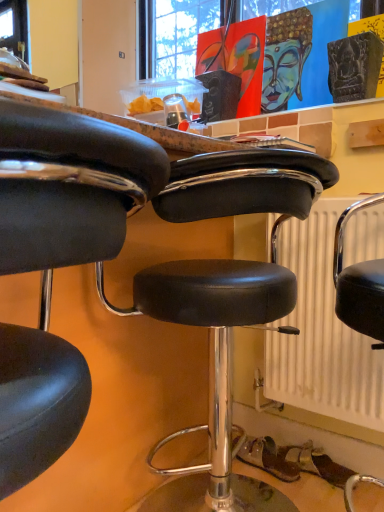
Question: Is the position of white textured radiator at center less distant than that of black leather stool at center, arranged as the second chair when viewed from the front?

Choices:
 (A) yes
 (B) no

Answer: (A)

Question: Is white textured radiator at center next to black leather stool at center, arranged as the second chair when viewed from the front?

Choices:
 (A) no
 (B) yes

Answer: (A)

Question: Considering the relative sizes of white textured radiator at center and black leather stool at center, arranged as the second chair when viewed from the front, in the image provided, is white textured radiator at center wider than black leather stool at center, arranged as the second chair when viewed from the front,?

Choices:
 (A) no
 (B) yes

Answer: (A)

Question: Does white textured radiator at center have a larger size compared to black leather stool at center, arranged as the second chair when viewed from the front?

Choices:
 (A) no
 (B) yes

Answer: (A)

Question: From a real-world perspective, is white textured radiator at center located beneath black leather stool at center, arranged as the second chair when viewed from the front?

Choices:
 (A) no
 (B) yes

Answer: (A)

Question: From the image's perspective, is white textured radiator at center above or below black leather stool at center, arranged as the second chair when viewed from the front?

Choices:
 (A) above
 (B) below

Answer: (A)

Question: From a real-world perspective, is white textured radiator at center physically located above or below black leather stool at center, arranged as the second chair when viewed from the front?

Choices:
 (A) above
 (B) below

Answer: (A)

Question: Is white textured radiator at center inside or outside of black leather stool at center, arranged as the second chair when viewed from the front?

Choices:
 (A) outside
 (B) inside

Answer: (A)

Question: Considering their positions, is white textured radiator at center located in front of or behind black leather stool at center, arranged as the second chair when viewed from the front?

Choices:
 (A) behind
 (B) front

Answer: (B)

Question: Does point (64, 406) appear closer or farther from the camera than point (238, 198)?

Choices:
 (A) farther
 (B) closer

Answer: (B)

Question: Is black leather stool at center, placed as the 2th chair when sorted from back to front, in front of or behind black leather stool at center, the 1th chair from the back, in the image?

Choices:
 (A) front
 (B) behind

Answer: (A)

Question: Is black leather stool at center, which ranks as the first chair in front-to-back order, bigger or smaller than black leather stool at center, arranged as the second chair when viewed from the front?

Choices:
 (A) big
 (B) small

Answer: (B)

Question: In the image, is black leather stool at center, which ranks as the first chair in front-to-back order, on the left side or the right side of black leather stool at center, the 1th chair from the back?

Choices:
 (A) right
 (B) left

Answer: (B)

Question: In terms of width, does black leather stool at center, arranged as the second chair when viewed from the front, look wider or thinner when compared to white textured radiator at center?

Choices:
 (A) thin
 (B) wide

Answer: (B)

Question: In the image, is black leather stool at center, arranged as the second chair when viewed from the front, positioned in front of or behind white textured radiator at center?

Choices:
 (A) behind
 (B) front

Answer: (A)